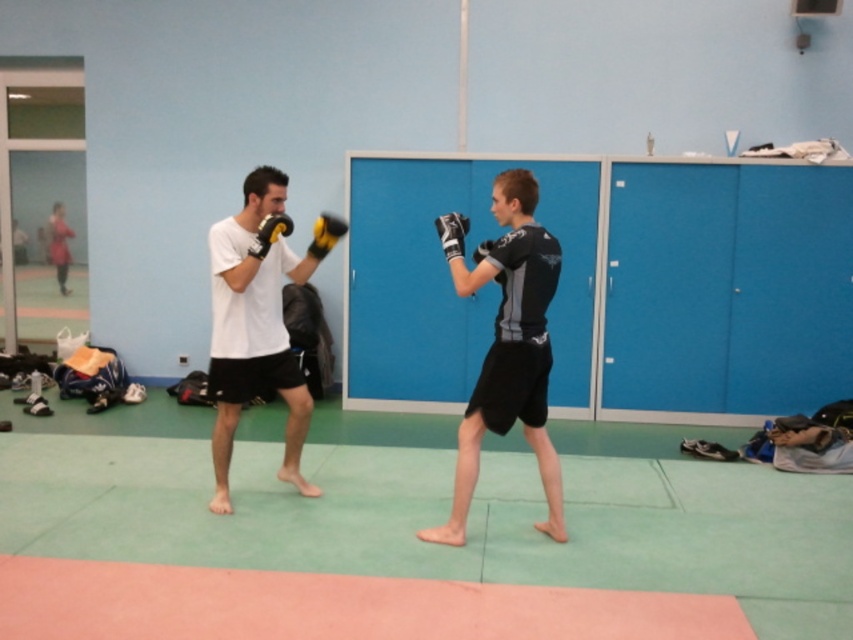
Which of these two, white matte t-shirt at center or yellow matte boxing glove at upper center, stands shorter?

With less height is yellow matte boxing glove at upper center.

Image resolution: width=853 pixels, height=640 pixels. I want to click on white matte t-shirt at center, so click(x=254, y=330).

Does point (248, 372) lie in front of point (317, 252)?

No, it is not.

I want to click on white matte t-shirt at center, so click(254, 330).

Is matte black boxing glove at center behind matte black boxing glove at left?

No, matte black boxing glove at center is in front of matte black boxing glove at left.

Is point (450, 241) less distant than point (257, 243)?

Yes.

Who is more distant from viewer, (439, 230) or (254, 253)?

Point (254, 253)

Image resolution: width=853 pixels, height=640 pixels. What are the coordinates of `matte black boxing glove at center` in the screenshot? It's located at (451, 234).

Is point (548, 364) closer to camera compared to point (216, 388)?

Yes, it is in front of point (216, 388).

Can you confirm if black matte/soft boxing gloves at center is shorter than white matte t-shirt at center?

Incorrect, black matte/soft boxing gloves at center's height does not fall short of white matte t-shirt at center's.

Is point (514, 234) in front of point (225, 276)?

Yes.

The height and width of the screenshot is (640, 853). What are the coordinates of `black matte/soft boxing gloves at center` in the screenshot? It's located at (509, 349).